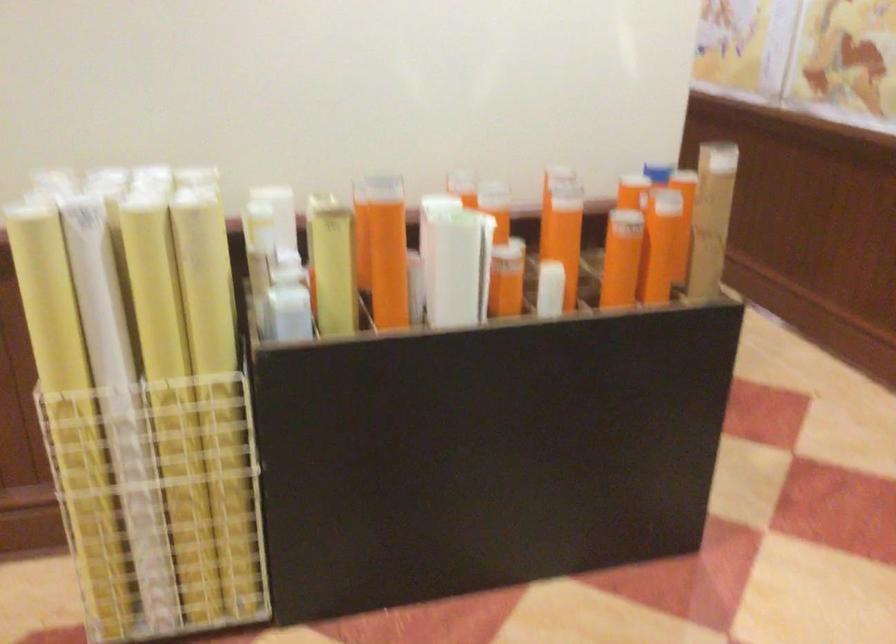
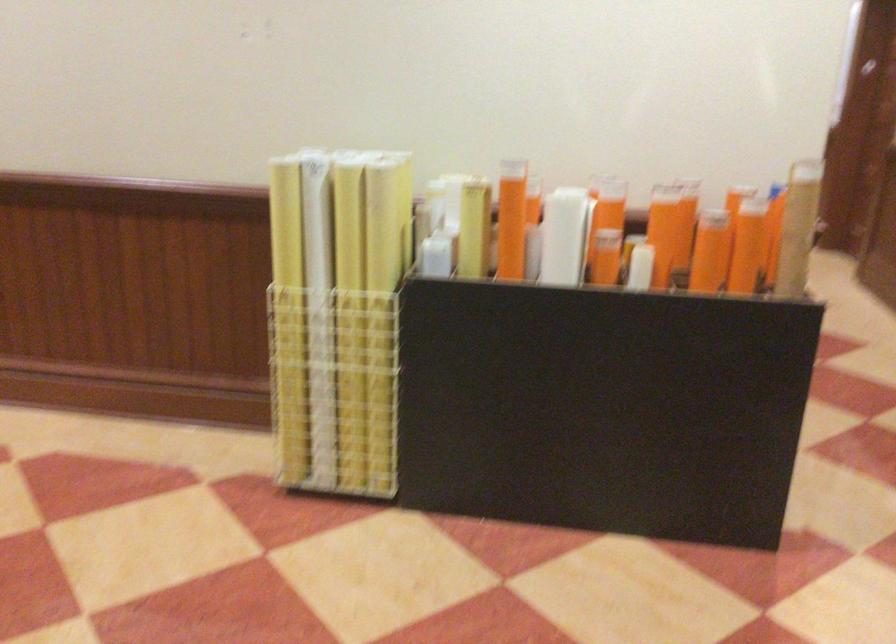
Find the pixel in the second image that matches (659,245) in the first image.

(746, 245)